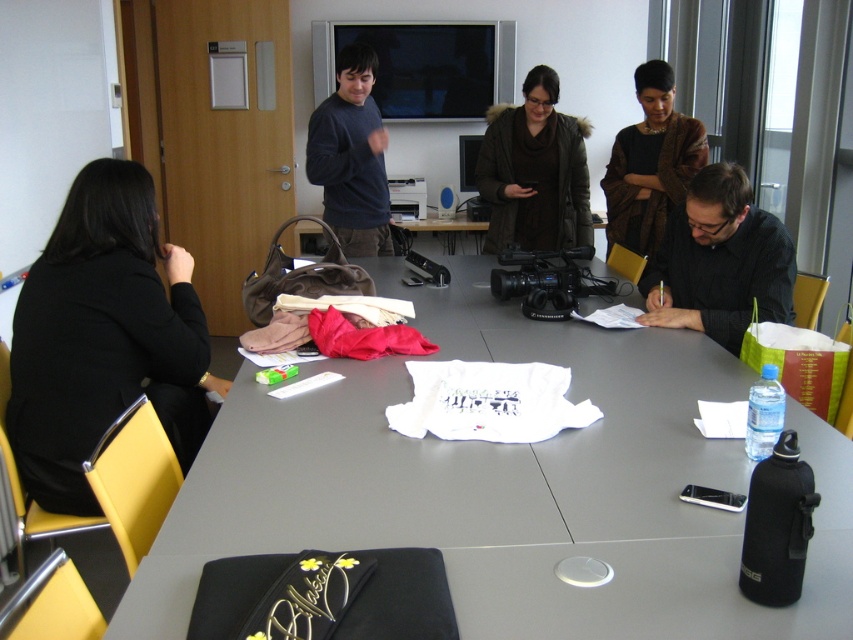
Question: Estimate the real-world distances between objects in this image. Which object is closer to the brown textured coat at upper center?

Choices:
 (A) brown fuzzy coat at center
 (B) black matte shirt at center

Answer: (A)

Question: Does black fabric jacket at left have a smaller size compared to black matte shirt at center?

Choices:
 (A) no
 (B) yes

Answer: (A)

Question: From the image, what is the correct spatial relationship of white fabric shirt at center in relation to black matte shirt at center?

Choices:
 (A) below
 (B) above

Answer: (A)

Question: Which point is farther to the camera?

Choices:
 (A) (380, 202)
 (B) (492, 132)
 (C) (360, 403)

Answer: (A)

Question: Which point is closer to the camera?

Choices:
 (A) (577, 339)
 (B) (114, 282)
 (C) (730, 291)

Answer: (B)

Question: Can you confirm if brown fuzzy coat at center is smaller than brown textured coat at upper center?

Choices:
 (A) no
 (B) yes

Answer: (B)